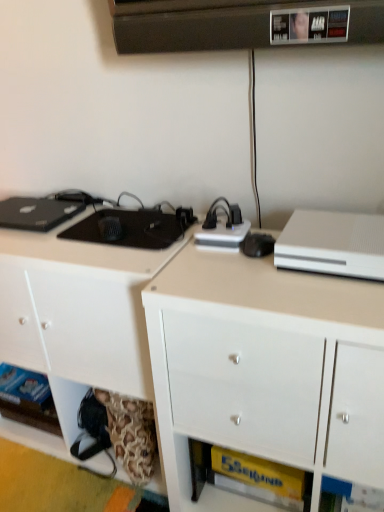
The width and height of the screenshot is (384, 512). I want to click on blank space to the left of white matte desktop computer at upper right, so click(242, 279).